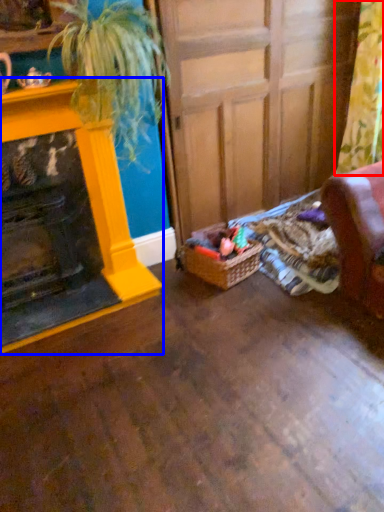
Question: Which object is further to the camera taking this photo, curtain (highlighted by a red box) or fireplace (highlighted by a blue box)?

Choices:
 (A) curtain
 (B) fireplace

Answer: (A)